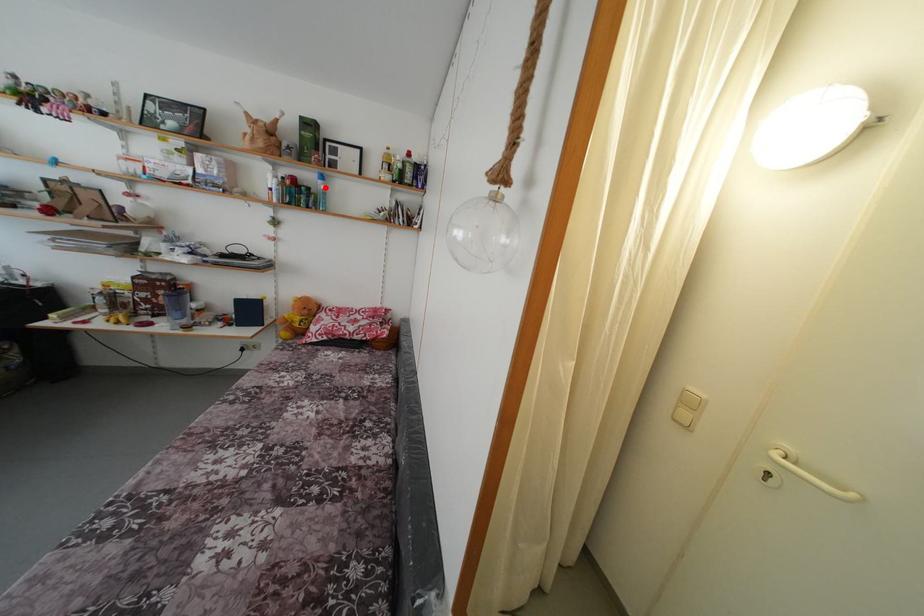
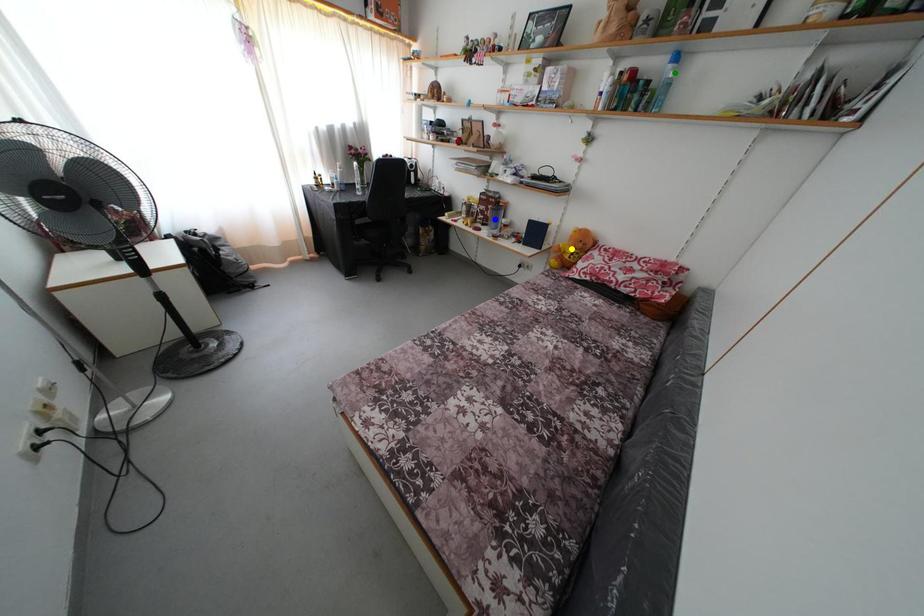
Question: I am providing you with two images of the same scene from different viewpoints. A red point is marked on the first image. You are given multiple points on the second image. In image 2, which mark is for the same physical point as the one in image 1?

Choices:
 (A) blue point
 (B) yellow point
 (C) green point

Answer: (C)